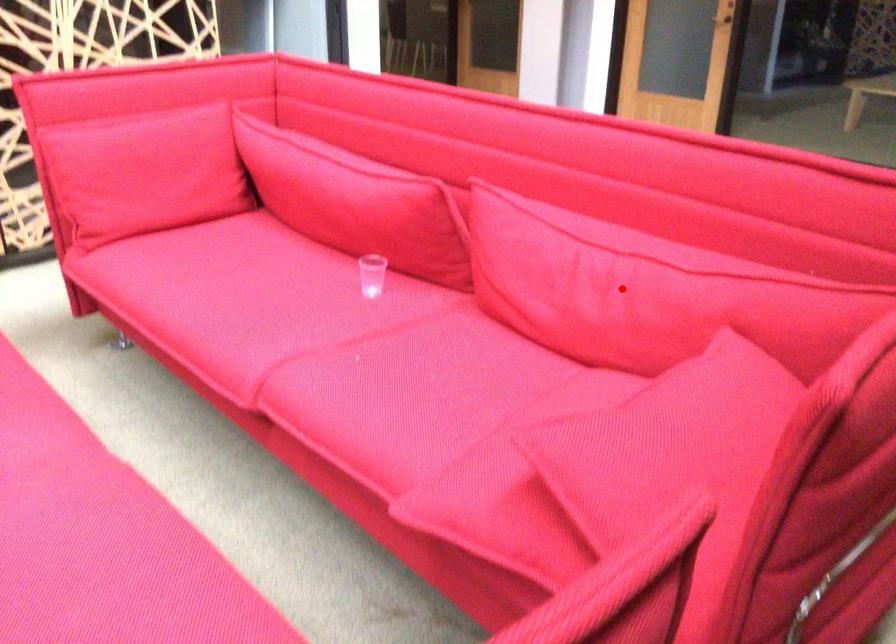
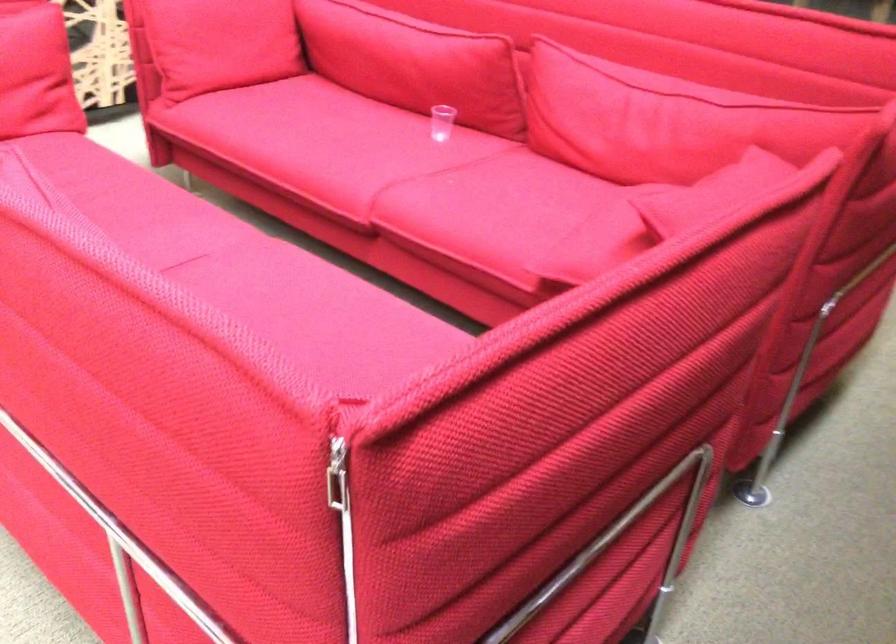
Question: I am providing you with two images of the same scene from different viewpoints. In image1, a red point is highlighted. Considering the same 3D point in image2, which of the following is correct?

Choices:
 (A) It is closer
 (B) It is farther

Answer: (B)